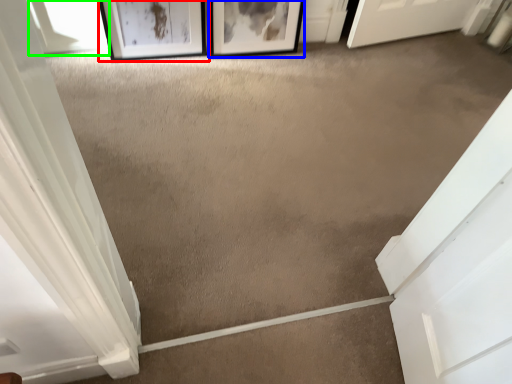
Question: Which object is positioned farthest from picture frame (highlighted by a red box)? Select from picture frame (highlighted by a blue box) and window (highlighted by a green box).

Choices:
 (A) picture frame
 (B) window

Answer: (A)